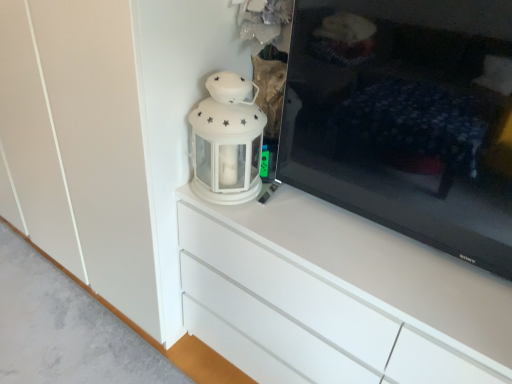
Question: Can you see black glossy tv at right touching white glossy lantern at upper center?

Choices:
 (A) yes
 (B) no

Answer: (B)

Question: Considering the relative sizes of black glossy tv at right and white glossy lantern at upper center in the image provided, is black glossy tv at right bigger than white glossy lantern at upper center?

Choices:
 (A) no
 (B) yes

Answer: (B)

Question: Considering the relative positions of black glossy tv at right and white glossy lantern at upper center in the image provided, is black glossy tv at right in front of white glossy lantern at upper center?

Choices:
 (A) no
 (B) yes

Answer: (B)

Question: Does black glossy tv at right have a greater width compared to white glossy lantern at upper center?

Choices:
 (A) no
 (B) yes

Answer: (A)

Question: Is black glossy tv at right outside of white glossy lantern at upper center?

Choices:
 (A) yes
 (B) no

Answer: (A)

Question: Based on their sizes in the image, would you say black glossy tv at right is bigger or smaller than white glossy chest of drawers at center?

Choices:
 (A) big
 (B) small

Answer: (B)

Question: From the image's perspective, is black glossy tv at right positioned above or below white glossy chest of drawers at center?

Choices:
 (A) above
 (B) below

Answer: (A)

Question: Is point (428, 127) closer or farther from the camera than point (230, 297)?

Choices:
 (A) closer
 (B) farther

Answer: (A)

Question: Considering the positions of black glossy tv at right and white glossy chest of drawers at center in the image, is black glossy tv at right wider or thinner than white glossy chest of drawers at center?

Choices:
 (A) thin
 (B) wide

Answer: (A)

Question: From a real-world perspective, is white glossy chest of drawers at center physically located above or below white glossy lantern at upper center?

Choices:
 (A) below
 (B) above

Answer: (A)

Question: Would you say white glossy chest of drawers at center is to the left or to the right of white glossy lantern at upper center in the picture?

Choices:
 (A) left
 (B) right

Answer: (B)

Question: In terms of height, does white glossy chest of drawers at center look taller or shorter compared to white glossy lantern at upper center?

Choices:
 (A) short
 (B) tall

Answer: (B)

Question: Considering their positions, is white glossy chest of drawers at center located in front of or behind white glossy lantern at upper center?

Choices:
 (A) behind
 (B) front

Answer: (B)

Question: Considering the positions of white glossy lantern at upper center and black glossy tv at right in the image, is white glossy lantern at upper center bigger or smaller than black glossy tv at right?

Choices:
 (A) small
 (B) big

Answer: (A)

Question: Considering their positions, is white glossy lantern at upper center located in front of or behind black glossy tv at right?

Choices:
 (A) behind
 (B) front

Answer: (A)